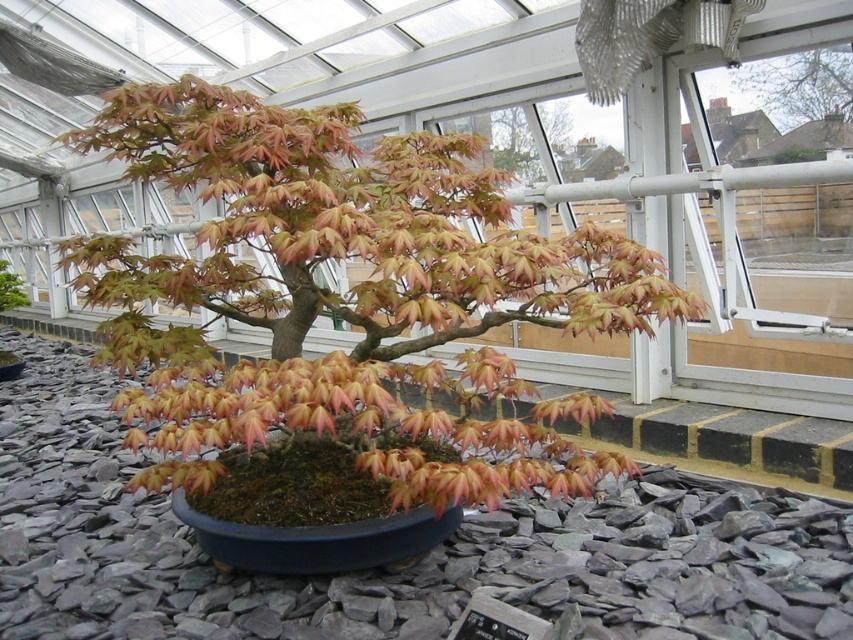
The width and height of the screenshot is (853, 640). What do you see at coordinates (393, 568) in the screenshot? I see `gray gravel at center` at bounding box center [393, 568].

Is gray gravel at center thinner than orange-brown bark tree at upper center?

No.

Is point (0, 618) less distant than point (524, 163)?

That is True.

What are the coordinates of `gray gravel at center` in the screenshot? It's located at (393, 568).

Based on the photo, between matte orange maple at center and orange-brown bark tree at upper center, which one is positioned higher?

Positioned higher is orange-brown bark tree at upper center.

The image size is (853, 640). What do you see at coordinates (344, 312) in the screenshot? I see `matte orange maple at center` at bounding box center [344, 312].

I want to click on matte orange maple at center, so click(344, 312).

Who is positioned more to the left, orange-brown bark tree at upper right or orange-brown bark tree at upper center?

From the viewer's perspective, orange-brown bark tree at upper center appears more on the left side.

The height and width of the screenshot is (640, 853). Identify the location of orange-brown bark tree at upper right. (799, 84).

At what (x,y) coordinates should I click in order to perform the action: click on orange-brown bark tree at upper right. Please return your answer as a coordinate pair (x, y). Looking at the image, I should click on (799, 84).